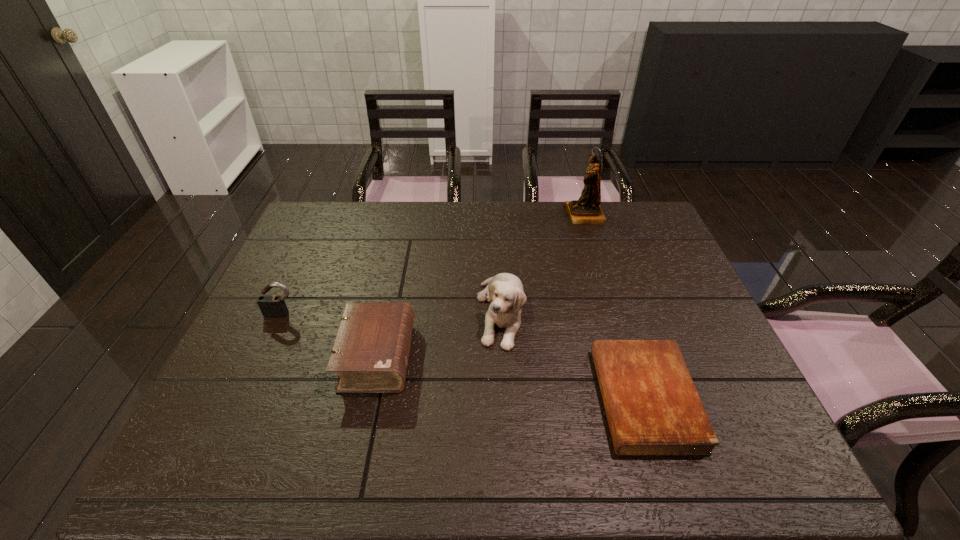
In order to click on free location located 0.080m on the front-facing side of the figurine in this screenshot , I will do `click(542, 215)`.

This screenshot has height=540, width=960. Find the location of `vacant space located 0.160m on the front-facing side of the figurine`. vacant space located 0.160m on the front-facing side of the figurine is located at coordinates (519, 215).

This screenshot has width=960, height=540. In order to click on vacant space located 0.330m on the front-facing side of the figurine in this screenshot , I will do `click(471, 215)`.

At what (x,y) coordinates should I click in order to perform the action: click on free space located 0.230m on the front-facing side of the second tallest object. Please return your answer as a coordinate pair (x, y). The height and width of the screenshot is (540, 960). Looking at the image, I should click on (507, 440).

Locate an element on the screen. This screenshot has height=540, width=960. free spot located 0.330m with the keyhole on the front of the padlock is located at coordinates (228, 433).

This screenshot has height=540, width=960. What are the coordinates of `vacant space located 0.400m on the spine side of the fourth tallest object` in the screenshot? It's located at (575, 357).

The height and width of the screenshot is (540, 960). In order to click on free space located on the spine side of the shorter Bible in this screenshot , I will do `click(516, 399)`.

This screenshot has width=960, height=540. Find the location of `free location located on the spine side of the shorter Bible`. free location located on the spine side of the shorter Bible is located at coordinates (498, 399).

Locate an element on the screen. This screenshot has width=960, height=540. vacant space located 0.400m on the spine side of the shorter Bible is located at coordinates (423, 399).

The width and height of the screenshot is (960, 540). Find the location of `object that is at the far edge`. object that is at the far edge is located at coordinates (587, 210).